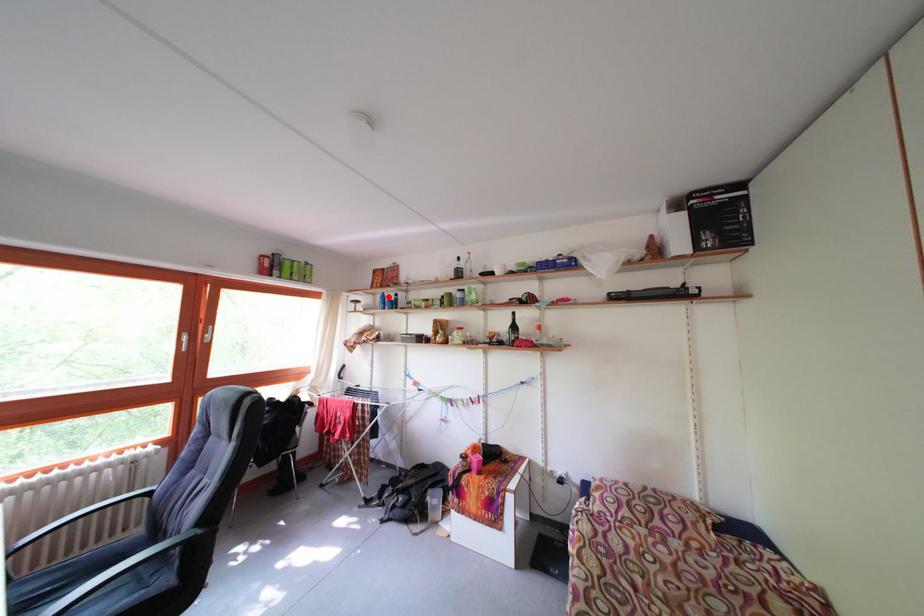
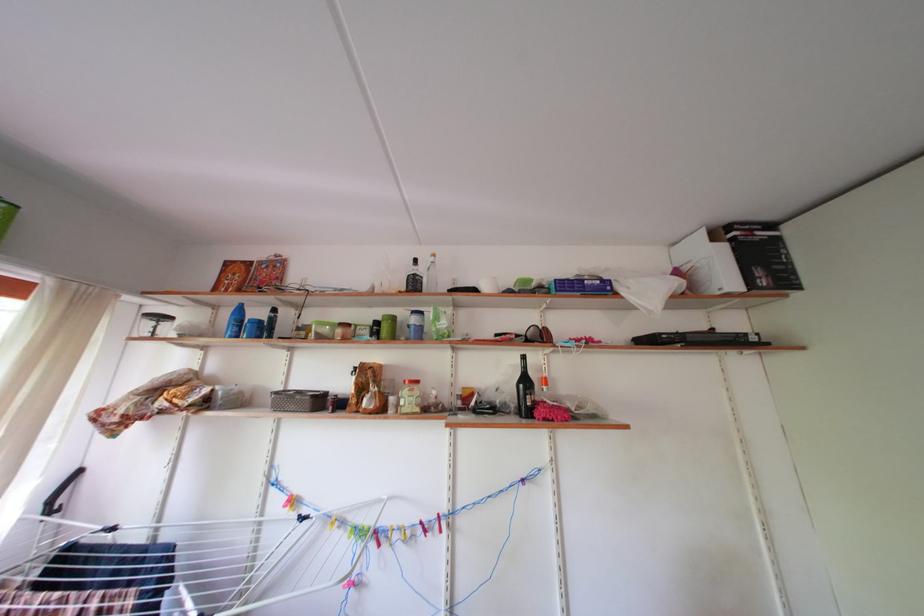
Where in the second image is the point corresponding to the highlighted location from the first image?

(242, 305)